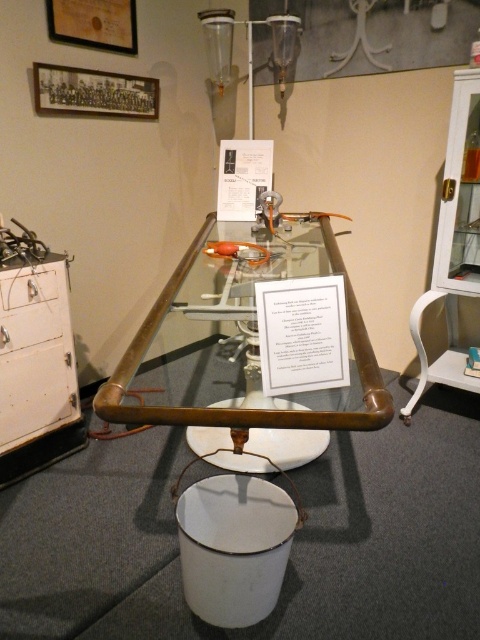
You are a museum guide explaining the layout of the exhibit. Where is the bronze polished table at center positioned in relation to the room?

The bronze polished table at center is positioned at point coordinates of 0.545 on the x and 0.535 on the y axis within the exhibit space.

You are a museum guide explaining the layout of the exhibit. Where is the bronze polished table at center located in the image?

Result: The bronze polished table at center is located at the central point of the image, specifically at coordinates (x=256, y=348).